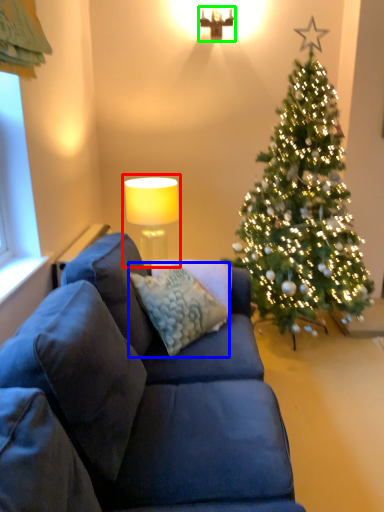
Question: Based on their relative distances, which object is farther from table lamp (highlighted by a red box)? Choose from pillow (highlighted by a blue box) and lamp (highlighted by a green box).

Choices:
 (A) pillow
 (B) lamp

Answer: (B)